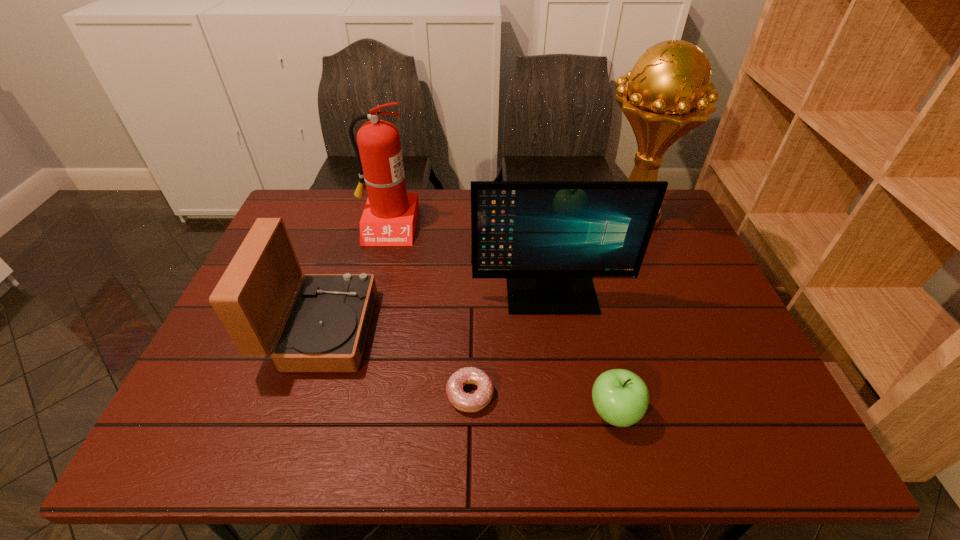
Where is `vacant space that satisfies the following two spatial constraints: 1. on the front-facing side of the fire extinguisher; 2. on the left side of the doughnut`? vacant space that satisfies the following two spatial constraints: 1. on the front-facing side of the fire extinguisher; 2. on the left side of the doughnut is located at coordinates (346, 394).

In order to click on blank area in the image that satisfies the following two spatial constraints: 1. at the front of the tallest object where the globe is prominent; 2. on the front side of the fifth tallest object in this screenshot , I will do `click(711, 412)`.

Image resolution: width=960 pixels, height=540 pixels. Find the location of `vacant region that satisfies the following two spatial constraints: 1. on the face of the phonograph record; 2. on the back side of the second shortest object`. vacant region that satisfies the following two spatial constraints: 1. on the face of the phonograph record; 2. on the back side of the second shortest object is located at coordinates (295, 412).

Locate an element on the screen. vacant space that satisfies the following two spatial constraints: 1. on the front-facing side of the fifth tallest object; 2. on the right side of the fire extinguisher is located at coordinates (341, 412).